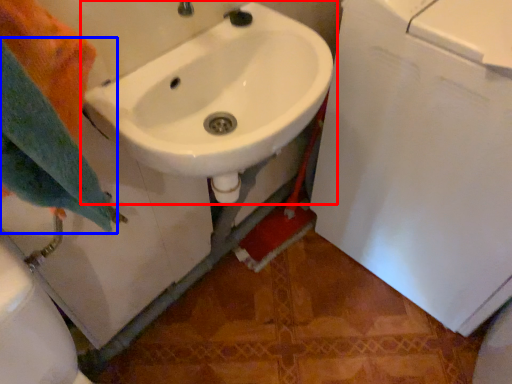
Question: Among these objects, which one is farthest to the camera, sink (highlighted by a red box) or bath towel (highlighted by a blue box)?

Choices:
 (A) sink
 (B) bath towel

Answer: (A)